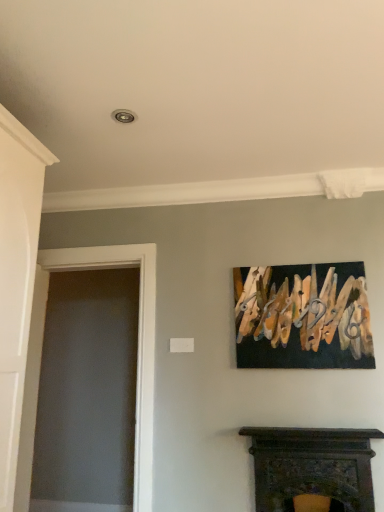
Question: Is dark wood fireplace at lower center in contact with white painted wood door at left?

Choices:
 (A) yes
 (B) no

Answer: (B)

Question: Could white painted wood door at left be considered to be inside dark wood fireplace at lower center?

Choices:
 (A) yes
 (B) no

Answer: (B)

Question: Can you confirm if dark wood fireplace at lower center is taller than white painted wood door at left?

Choices:
 (A) no
 (B) yes

Answer: (A)

Question: Does dark wood fireplace at lower center come behind white painted wood door at left?

Choices:
 (A) no
 (B) yes

Answer: (A)

Question: Is dark wood fireplace at lower center at the left side of white painted wood door at left?

Choices:
 (A) no
 (B) yes

Answer: (A)

Question: Considering the relative sizes of dark wood fireplace at lower center and white painted wood door at left in the image provided, is dark wood fireplace at lower center shorter than white painted wood door at left?

Choices:
 (A) no
 (B) yes

Answer: (B)

Question: From a real-world perspective, is white painted wood door at left physically below wooden clothespins at upper right?

Choices:
 (A) no
 (B) yes

Answer: (B)

Question: Considering the relative sizes of white painted wood door at left and wooden clothespins at upper right in the image provided, is white painted wood door at left shorter than wooden clothespins at upper right?

Choices:
 (A) no
 (B) yes

Answer: (A)

Question: Is white painted wood door at left positioned before wooden clothespins at upper right?

Choices:
 (A) no
 (B) yes

Answer: (A)

Question: From the image's perspective, is white painted wood door at left below wooden clothespins at upper right?

Choices:
 (A) yes
 (B) no

Answer: (A)

Question: Considering the relative sizes of white painted wood door at left and wooden clothespins at upper right in the image provided, is white painted wood door at left taller than wooden clothespins at upper right?

Choices:
 (A) yes
 (B) no

Answer: (A)

Question: Is white painted wood door at left facing away from wooden clothespins at upper right?

Choices:
 (A) yes
 (B) no

Answer: (B)

Question: Is transparent glass door at left turned away from white painted wood door at left?

Choices:
 (A) no
 (B) yes

Answer: (B)